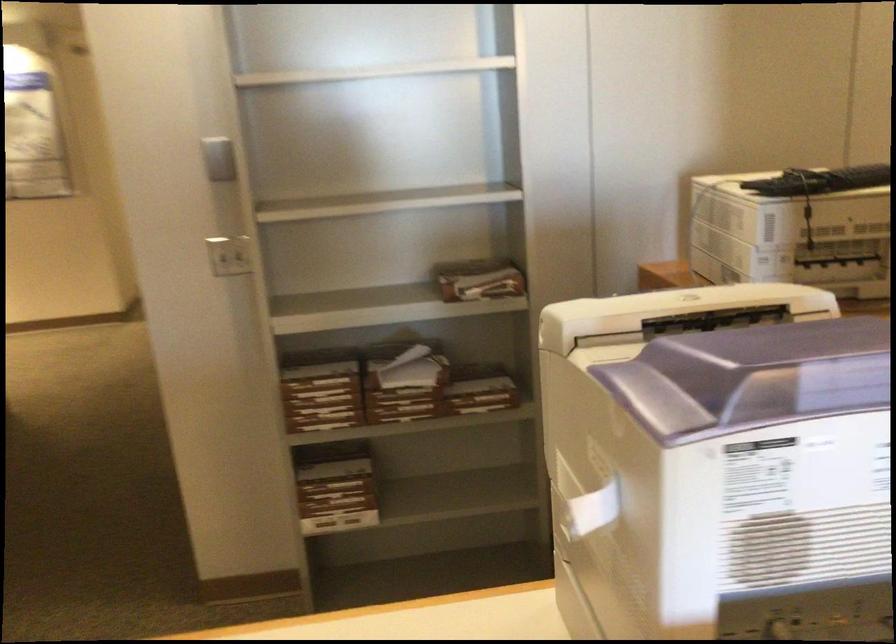
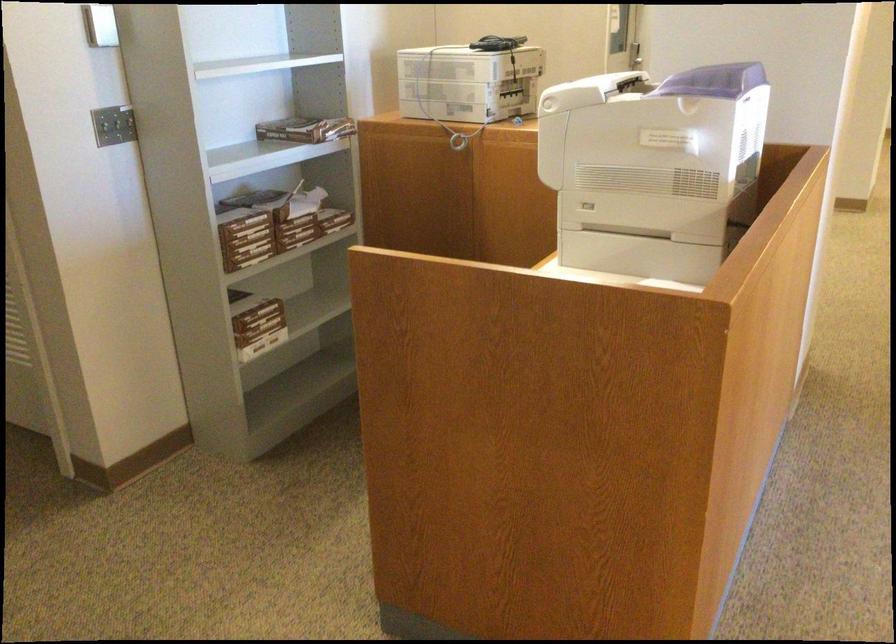
Find the pixel in the second image that matches [309,404] in the first image.

(246, 237)